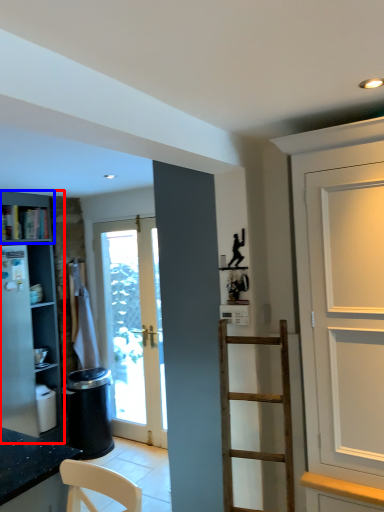
Question: Which object is closer to the camera taking this photo, cabinetry (highlighted by a red box) or cabinet (highlighted by a blue box)?

Choices:
 (A) cabinetry
 (B) cabinet

Answer: (A)